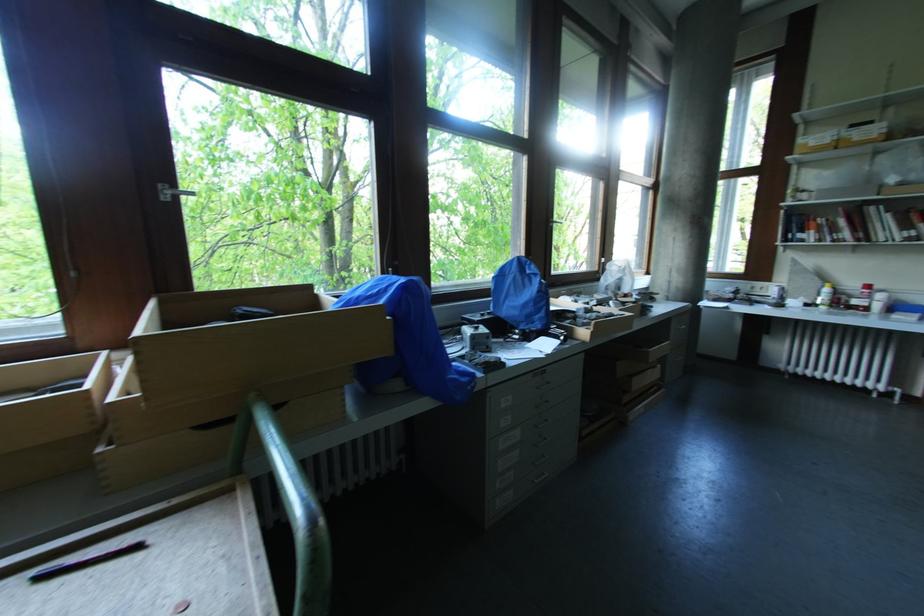
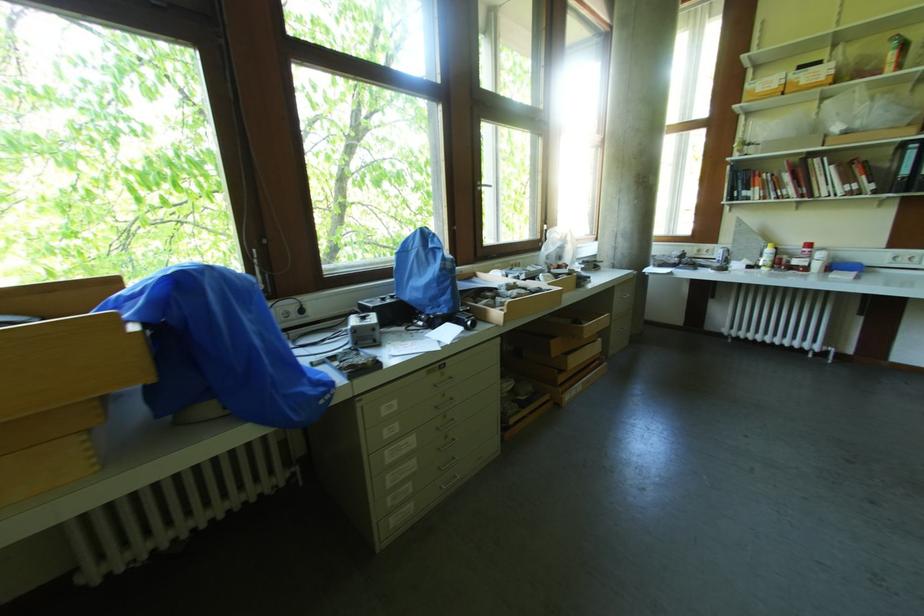
In a continuous first-person perspective shot, in which direction is the camera moving?

The cameraman moved toward right, forward.